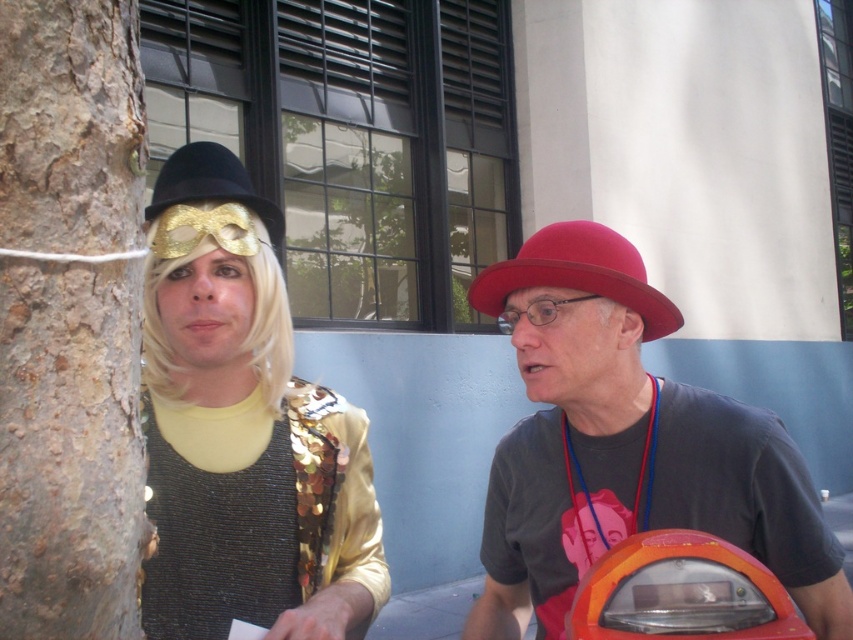
You are a delivery person trying to find the parking meter to pay for your spot. You see the orange plastic parking meter at lower right and the gold sequined hat at upper left. Which object is lower in the image?

The orange plastic parking meter at lower right is located below the gold sequined hat at upper left, so the parking meter is lower in the image.

You are trying to determine which of the two points, point (328, 604) or point (366, 417), is nearer to you in the image. Based on the scene, can you identify which point is closer?

Point (328, 604) is closer to the viewer than point (366, 417).

You are a photographer trying to capture both the shiny gold mask at left and the matte red hat at center in a single shot. Which object should you focus on first to ensure both are in focus?

You should focus on the shiny gold mask at left first because it is closer to the viewer than the matte red hat at center, so adjusting focus from near to far will help both objects be in focus.